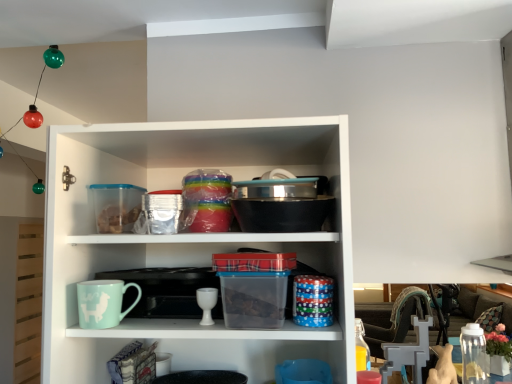
Question: Is light blue ceramic mug at lower left shorter than white glossy goblet at center?

Choices:
 (A) yes
 (B) no

Answer: (B)

Question: From a real-world perspective, is light blue ceramic mug at lower left positioned over white glossy goblet at center based on gravity?

Choices:
 (A) yes
 (B) no

Answer: (A)

Question: From a real-world perspective, is light blue ceramic mug at lower left physically below white glossy goblet at center?

Choices:
 (A) no
 (B) yes

Answer: (A)

Question: Is light blue ceramic mug at lower left closer to the viewer compared to white glossy goblet at center?

Choices:
 (A) yes
 (B) no

Answer: (A)

Question: Is light blue ceramic mug at lower left next to white glossy goblet at center and touching it?

Choices:
 (A) yes
 (B) no

Answer: (B)

Question: Considering the positions of point (478, 327) and point (79, 284), is point (478, 327) closer or farther from the camera than point (79, 284)?

Choices:
 (A) closer
 (B) farther

Answer: (B)

Question: Considering the positions of clear plastic jar at lower right and light blue ceramic mug at lower left in the image, is clear plastic jar at lower right bigger or smaller than light blue ceramic mug at lower left?

Choices:
 (A) big
 (B) small

Answer: (A)

Question: Would you say clear plastic jar at lower right is inside or outside light blue ceramic mug at lower left?

Choices:
 (A) outside
 (B) inside

Answer: (A)

Question: In terms of height, does clear plastic jar at lower right look taller or shorter compared to light blue ceramic mug at lower left?

Choices:
 (A) tall
 (B) short

Answer: (A)

Question: Considering the positions of point (112, 319) and point (201, 307), is point (112, 319) closer or farther from the camera than point (201, 307)?

Choices:
 (A) closer
 (B) farther

Answer: (A)

Question: Do you think light blue ceramic mug at lower left is within white glossy goblet at center, or outside of it?

Choices:
 (A) inside
 (B) outside

Answer: (B)

Question: Looking at their shapes, would you say light blue ceramic mug at lower left is wider or thinner than white glossy goblet at center?

Choices:
 (A) wide
 (B) thin

Answer: (A)

Question: From the image's perspective, is light blue ceramic mug at lower left above or below white glossy goblet at center?

Choices:
 (A) above
 (B) below

Answer: (A)

Question: In the image, is white glossy goblet at center on the left side or the right side of clear plastic jar at lower right?

Choices:
 (A) right
 (B) left

Answer: (B)

Question: From a real-world perspective, relative to clear plastic jar at lower right, is white glossy goblet at center vertically above or below?

Choices:
 (A) below
 (B) above

Answer: (B)